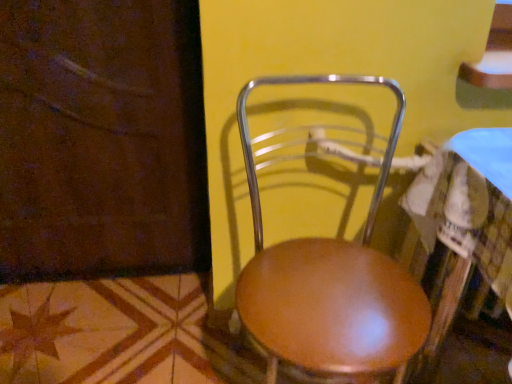
At what (x,y) coordinates should I click in order to perform the action: click on wooden seat at center. Please return your answer as a coordinate pair (x, y). This screenshot has height=384, width=512. Looking at the image, I should click on (330, 281).

What is the approximate height of shiny brown table at center?

shiny brown table at center is 30.70 inches tall.

What are the coordinates of `brown wood screen door at lower left` in the screenshot? It's located at (101, 140).

Considering the sizes of objects brown wood screen door at lower left and shiny brown table at center in the image provided, who is thinner, brown wood screen door at lower left or shiny brown table at center?

brown wood screen door at lower left.

Looking at this image, is brown wood screen door at lower left placed right next to shiny brown table at center?

No, brown wood screen door at lower left is not touching shiny brown table at center.

At what (x,y) coordinates should I click in order to perform the action: click on table on the right of the brown wood screen door at lower left. Please return your answer as a coordinate pair (x, y). Looking at the image, I should click on (463, 227).

Is shiny brown table at center bigger than wooden seat at center?

Correct, shiny brown table at center is larger in size than wooden seat at center.

Is shiny brown table at center positioned in front of wooden seat at center?

Yes, shiny brown table at center is in front of wooden seat at center.

Is point (507, 269) farther from viewer compared to point (362, 360)?

No, (507, 269) is in front of (362, 360).

Is shiny brown table at center facing away from wooden seat at center?

shiny brown table at center is not turned away from wooden seat at center.

Consider the image. Between brown wood screen door at lower left and wooden seat at center, which one has larger size?

Bigger between the two is wooden seat at center.

Considering the relative positions of brown wood screen door at lower left and wooden seat at center in the image provided, is brown wood screen door at lower left to the right of wooden seat at center from the viewer's perspective?

Incorrect, brown wood screen door at lower left is not on the right side of wooden seat at center.

Is point (23, 136) farther from camera compared to point (336, 273)?

Yes, it is behind point (336, 273).

Considering the sizes of wooden seat at center and shiny brown table at center in the image, is wooden seat at center bigger or smaller than shiny brown table at center?

In the image, wooden seat at center appears to be smaller than shiny brown table at center.

Is wooden seat at center turned away from shiny brown table at center?

wooden seat at center is not turned away from shiny brown table at center.

From a real-world perspective, is wooden seat at center beneath shiny brown table at center?

Incorrect, from a real-world perspective, wooden seat at center is higher than shiny brown table at center.

Consider the image. Which point is more forward, [295,341] or [433,281]?

The point [295,341] is more forward.

Does point (345, 282) come farther from viewer compared to point (177, 160)?

No, (345, 282) is in front of (177, 160).

Who is smaller, wooden seat at center or brown wood screen door at lower left?

brown wood screen door at lower left is smaller.

Does wooden seat at center have a lesser height compared to brown wood screen door at lower left?

Yes.

Based on the photo, is shiny brown table at center inside or outside of brown wood screen door at lower left?

shiny brown table at center is not inside brown wood screen door at lower left, it's outside.

From a real-world perspective, is shiny brown table at center physically below brown wood screen door at lower left?

Yes, from a real-world perspective, shiny brown table at center is beneath brown wood screen door at lower left.

This screenshot has height=384, width=512. Find the location of `table below the brown wood screen door at lower left (from the image's perspective)`. table below the brown wood screen door at lower left (from the image's perspective) is located at coordinates (463, 227).

Which is more to the left, shiny brown table at center or brown wood screen door at lower left?

brown wood screen door at lower left.

You are a GUI agent. You are given a task and a screenshot of the screen. Output one action in this format:
    pyautogui.click(x=<x>, y=<y>)
    Task: Click on the screen door that appears above the shiny brown table at center (from the image's perspective)
    This screenshot has width=512, height=384.
    Given the screenshot: What is the action you would take?
    pyautogui.click(x=101, y=140)

Identify the location of table lying on the right of wooden seat at center. The height and width of the screenshot is (384, 512). (463, 227).

Based on their spatial positions, is brown wood screen door at lower left or shiny brown table at center further from wooden seat at center?

brown wood screen door at lower left is positioned further to the anchor wooden seat at center.

Based on the photo, when comparing their distances from brown wood screen door at lower left, does wooden seat at center or shiny brown table at center seem further?

Among the two, shiny brown table at center is located further to brown wood screen door at lower left.

Looking at the image, which one is located closer to brown wood screen door at lower left, shiny brown table at center or wooden seat at center?

wooden seat at center lies closer to brown wood screen door at lower left than the other object.

Estimate the real-world distances between objects in this image. Which object is further from shiny brown table at center, wooden seat at center or brown wood screen door at lower left?

The object further to shiny brown table at center is brown wood screen door at lower left.

Looking at the image, which one is located further to wooden seat at center, shiny brown table at center or brown wood screen door at lower left?

brown wood screen door at lower left.

From the image, which object appears to be farther from shiny brown table at center, brown wood screen door at lower left or wooden seat at center?

brown wood screen door at lower left.

Locate an element on the screen. chair between brown wood screen door at lower left and shiny brown table at center is located at coordinates (330, 281).